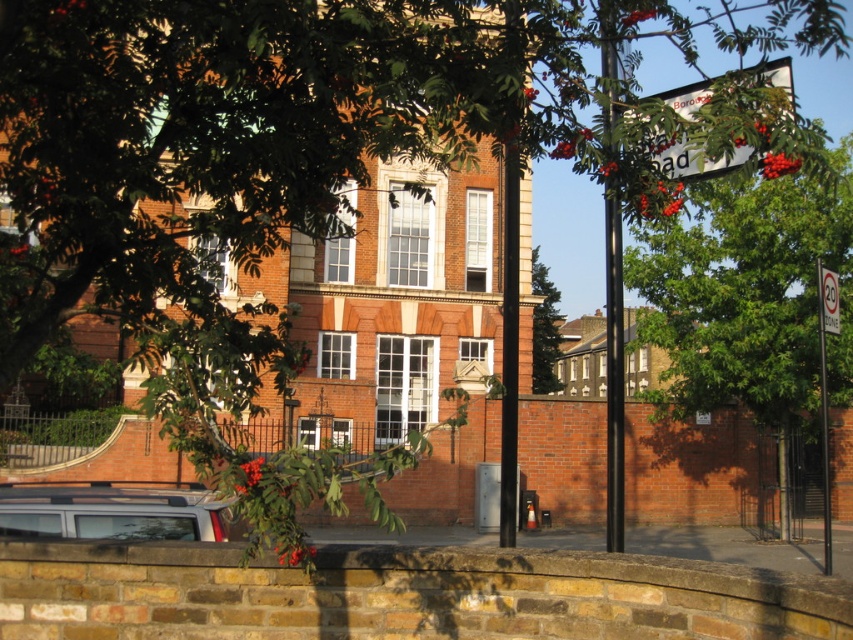
Based on the photo, which of these two, black metal pole at center or white plastic sign at upper right, stands taller?

black metal pole at center

Between point (506, 296) and point (762, 70), which one is positioned in front?

Point (762, 70)

Between point (509, 301) and point (711, 166), which one is positioned in front?

Point (711, 166)

Find the location of a particular element. The image size is (853, 640). black metal pole at center is located at coordinates (509, 339).

Is point (660, 96) closer to camera compared to point (833, 316)?

Yes.

Does point (751, 147) come farther from viewer compared to point (834, 314)?

No, (751, 147) is closer to viewer.

Locate an element on the screen. The image size is (853, 640). white plastic sign at upper right is located at coordinates (693, 157).

Can you confirm if black metal pole at right is smaller than white plastic sign at upper right?

Incorrect, black metal pole at right is not smaller in size than white plastic sign at upper right.

Which is more to the left, black metal pole at right or white plastic sign at upper right?

From the viewer's perspective, white plastic sign at upper right appears more on the left side.

Find the location of a particular element. The width and height of the screenshot is (853, 640). black metal pole at right is located at coordinates (612, 284).